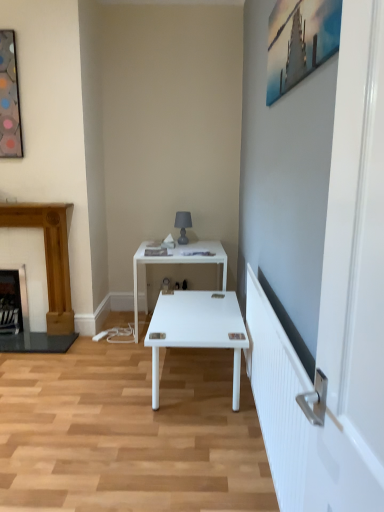
Question: Looking at their shapes, would you say matte gray lamp at upper center is wider or thinner than black metal fireplace at left, placed as the 2th fireplace when sorted from right to left?

Choices:
 (A) thin
 (B) wide

Answer: (A)

Question: Is matte gray lamp at upper center taller or shorter than black metal fireplace at left, placed as the 2th fireplace when sorted from right to left?

Choices:
 (A) short
 (B) tall

Answer: (A)

Question: Which of these objects is positioned closest to the black metal fireplace at left, the 1th fireplace from the left?

Choices:
 (A) metallic glass picture frame at upper left, acting as the 2th picture frame starting from the front
 (B) wooden fireplace at left, placed as the second fireplace when sorted from left to right
 (C) white glossy desk at center
 (D) matte gray lamp at upper center
 (E) metallic silver painting at upper right, the second picture frame positioned from the left

Answer: (B)

Question: Which object is positioned farthest from the white glossy desk at center?

Choices:
 (A) black metal fireplace at left, the 1th fireplace from the left
 (B) matte gray lamp at upper center
 (C) metallic glass picture frame at upper left, acting as the 2th picture frame starting from the front
 (D) metallic silver painting at upper right, placed as the 1th picture frame when sorted from right to left
 (E) wooden fireplace at left, placed as the second fireplace when sorted from left to right

Answer: (D)